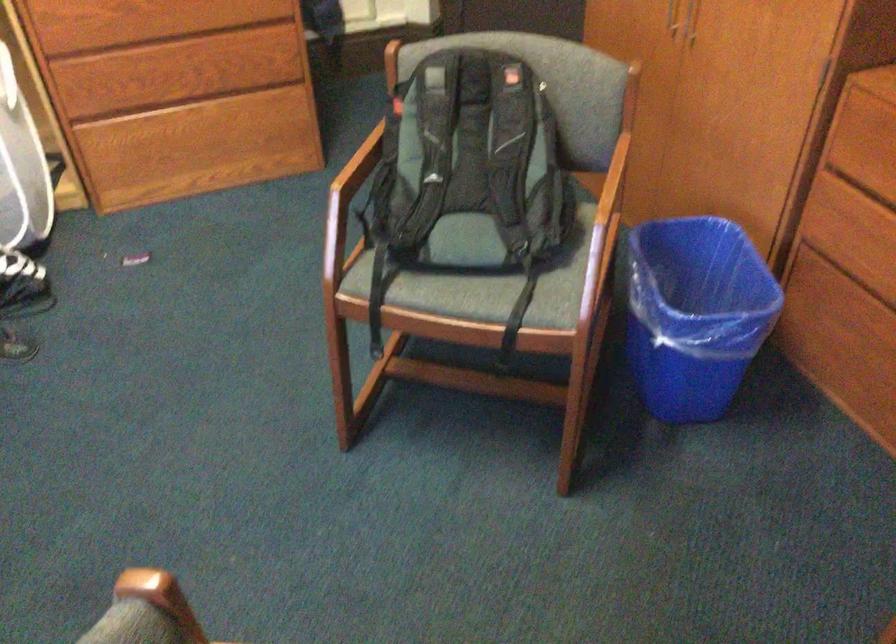
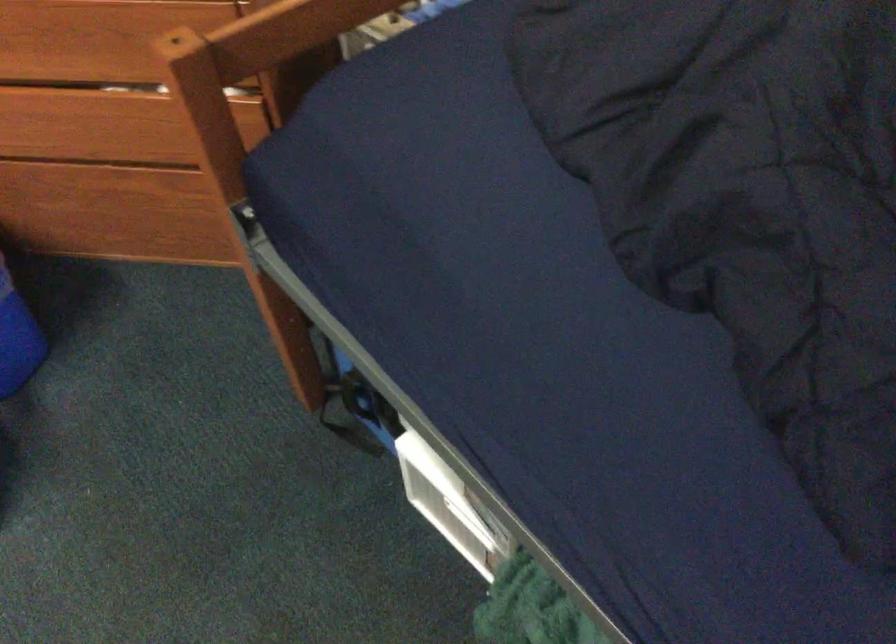
Based on the continuous images, in which direction is the camera rotating?

The camera rotated toward right-down.